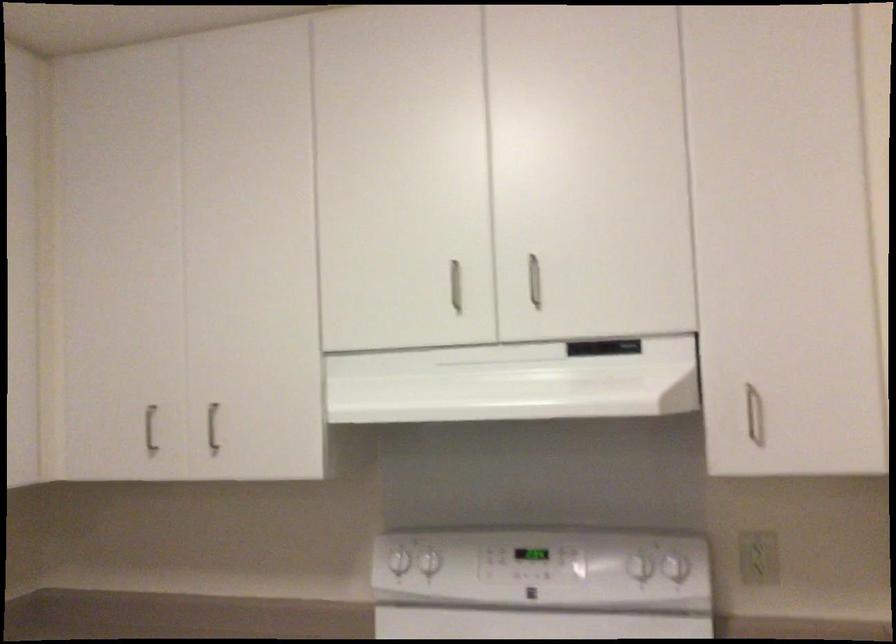
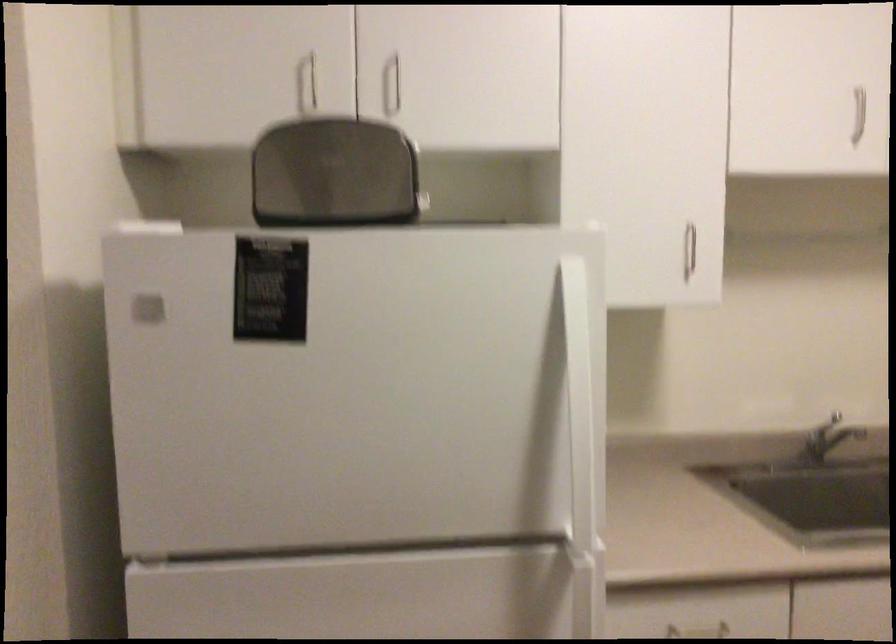
Question: The first image is from the beginning of the video and the second image is from the end. How did the camera likely rotate when shooting the video?

Choices:
 (A) Left
 (B) Right
 (C) Up
 (D) Down

Answer: (A)